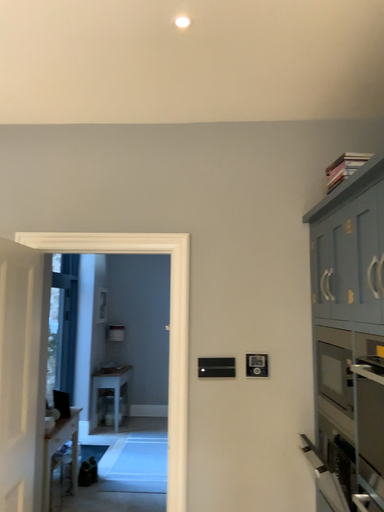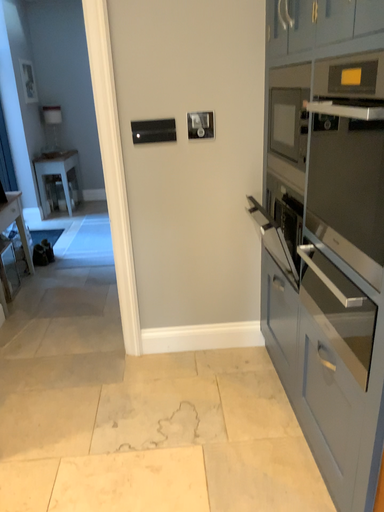
Question: Which way did the camera rotate in the video?

Choices:
 (A) rotated left
 (B) rotated right

Answer: (B)